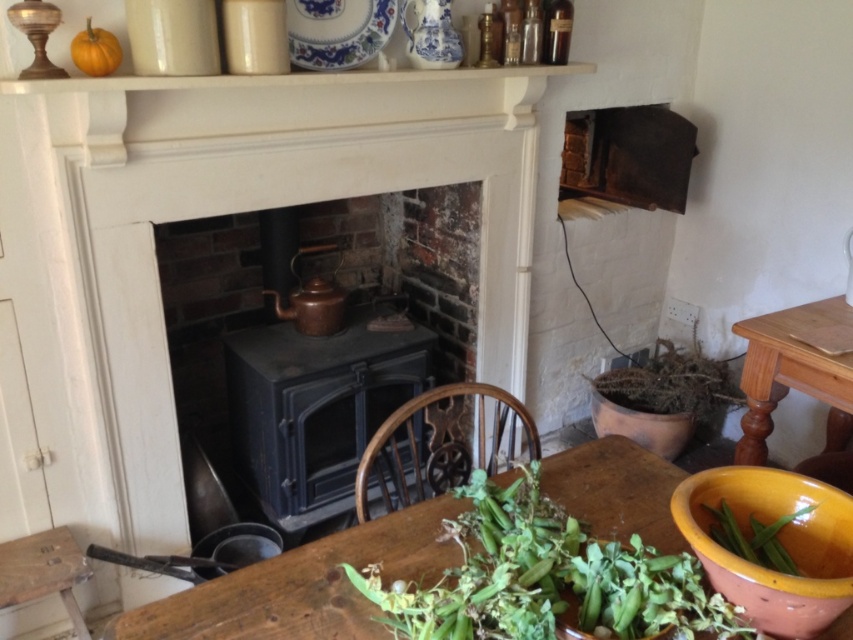
Question: Which is farther from the green leafy vegetable at lower right?

Choices:
 (A) wooden table at right
 (B) green leafy vegetable at lower center
 (C) brown textured plant at right

Answer: (C)

Question: Which point is closer to the camera?

Choices:
 (A) (386, 484)
 (B) (79, 61)

Answer: (B)

Question: Which object appears closest to the camera in this image?

Choices:
 (A) green leafy vegetable at lower right
 (B) wooden chair at center
 (C) green leafy vegetable at lower center
 (D) orange matte pumpkin at upper left

Answer: (C)

Question: Is wooden table at right to the right of green leafy vegetable at lower right from the viewer's perspective?

Choices:
 (A) yes
 (B) no

Answer: (A)

Question: Where is wooden chair at center located in relation to brown textured plant at right in the image?

Choices:
 (A) below
 (B) above

Answer: (A)

Question: Is wooden chair at center to the left of brown textured plant at right from the viewer's perspective?

Choices:
 (A) no
 (B) yes

Answer: (B)